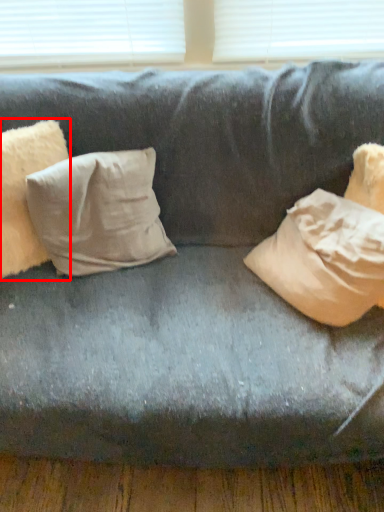
Question: From the image, what is the correct spatial relationship of pillow (annotated by the red box) in relation to pillow?

Choices:
 (A) left
 (B) right

Answer: (A)